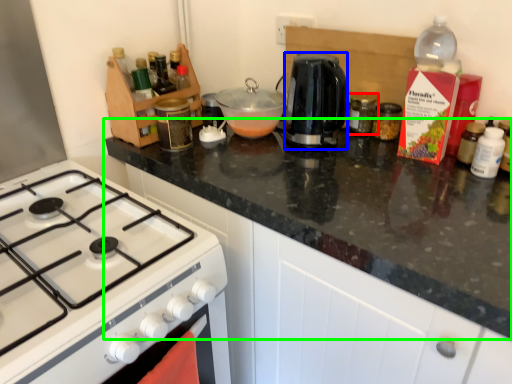
Question: Which object is positioned closest to kitchen appliance (highlighted by a red box)? Select from kitchen appliance (highlighted by a blue box) and countertop (highlighted by a green box).

Choices:
 (A) kitchen appliance
 (B) countertop

Answer: (A)